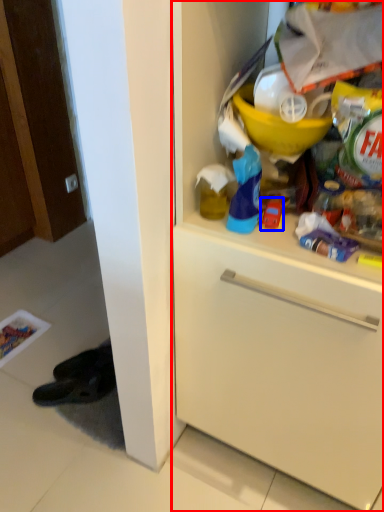
Question: Among these objects, which one is nearest to the camera, cabinetry (highlighted by a red box) or toy (highlighted by a blue box)?

Choices:
 (A) cabinetry
 (B) toy

Answer: (A)